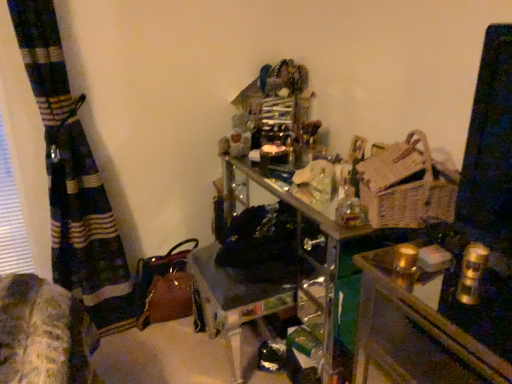
Question: From the image's perspective, relative to metallic gold candlesticks at center, is woven wicker basket at right above or below?

Choices:
 (A) above
 (B) below

Answer: (A)

Question: Considering the positions of woven wicker basket at right and metallic gold candlesticks at center in the image, is woven wicker basket at right taller or shorter than metallic gold candlesticks at center?

Choices:
 (A) tall
 (B) short

Answer: (B)

Question: From a real-world perspective, relative to metallic gold candlesticks at center, is woven wicker basket at right vertically above or below?

Choices:
 (A) below
 (B) above

Answer: (B)

Question: Based on their positions, is metallic gold candlesticks at center located to the left or right of woven wicker basket at right?

Choices:
 (A) left
 (B) right

Answer: (B)

Question: Would you say metallic gold candlesticks at center is inside or outside woven wicker basket at right?

Choices:
 (A) inside
 (B) outside

Answer: (B)

Question: From their relative heights in the image, would you say metallic gold candlesticks at center is taller or shorter than woven wicker basket at right?

Choices:
 (A) short
 (B) tall

Answer: (B)

Question: From a real-world perspective, is metallic gold candlesticks at center positioned above or below woven wicker basket at right?

Choices:
 (A) above
 (B) below

Answer: (B)